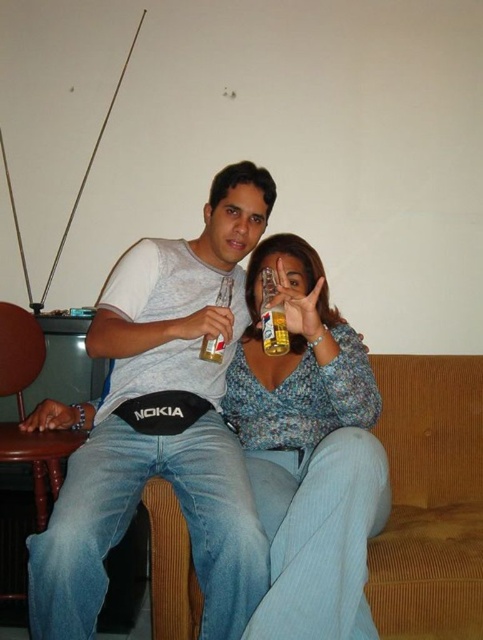
Is point (185, 364) positioned before point (213, 355)?

No, it is not.

From the picture: Who is positioned more to the right, white cotton shirt at center or clear glass beer bottle at center?

clear glass beer bottle at center is more to the right.

Describe the element at coordinates (160, 424) in the screenshot. I see `white cotton shirt at center` at that location.

Find the location of a particular element. white cotton shirt at center is located at coordinates (160, 424).

Is white cotton shirt at center smaller than floral blouse at center?

Incorrect, white cotton shirt at center is not smaller in size than floral blouse at center.

Based on the photo, which is more to the right, white cotton shirt at center or floral blouse at center?

Positioned to the right is floral blouse at center.

At what (x,y) coordinates should I click in order to perform the action: click on white cotton shirt at center. Please return your answer as a coordinate pair (x, y). This screenshot has width=483, height=640. Looking at the image, I should click on (160, 424).

Does brown wood chair at lower left have a lesser width compared to translucent glass beer bottle at center?

In fact, brown wood chair at lower left might be wider than translucent glass beer bottle at center.

Is brown wood chair at lower left positioned behind translucent glass beer bottle at center?

Yes, it is.

Between point (13, 339) and point (288, 348), which one is positioned in front?

Positioned in front is point (288, 348).

Locate an element on the screen. This screenshot has height=640, width=483. brown wood chair at lower left is located at coordinates click(39, 460).